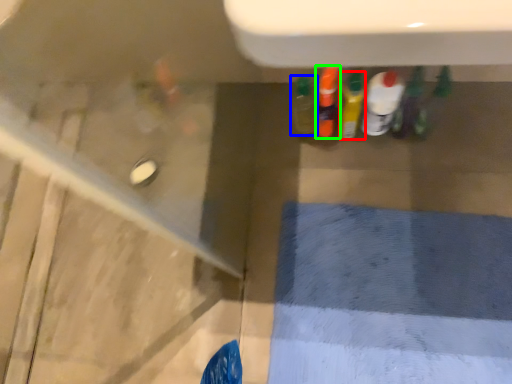
Question: Estimate the real-world distances between objects in this image. Which object is closer to bottle (highlighted by a red box), bottle (highlighted by a blue box) or bottle (highlighted by a green box)?

Choices:
 (A) bottle
 (B) bottle

Answer: (B)